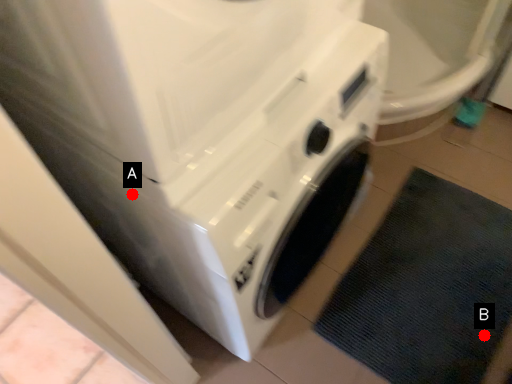
Question: Two points are circled on the image, labeled by A and B beside each circle. Which of the following is the farthest from the observer?

Choices:
 (A) A is further
 (B) B is further

Answer: (B)